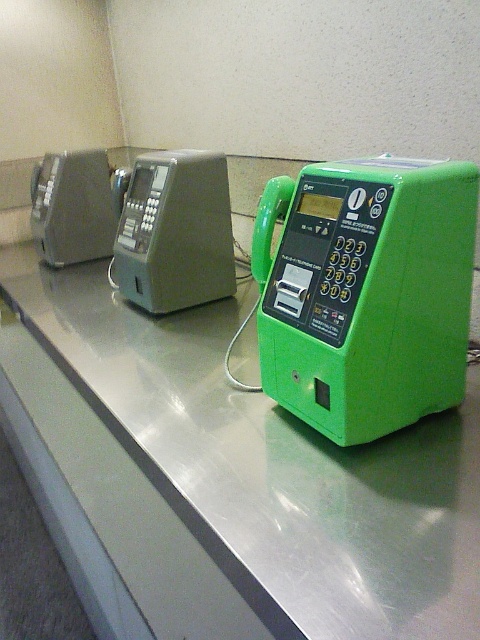
Is point (388, 534) more distant than point (462, 172)?

No, (388, 534) is closer to viewer.

Can you confirm if green plastic phone at right is wider than green plastic payphone at center?

Correct, the width of green plastic phone at right exceeds that of green plastic payphone at center.

Between point (83, 538) and point (301, 252), which one is positioned behind?

Positioned behind is point (83, 538).

Image resolution: width=480 pixels, height=640 pixels. Find the location of `green plastic phone at right`. green plastic phone at right is located at coordinates (228, 481).

Based on the photo, who is higher up, green plastic phone at right or matte gray phone box at center?

matte gray phone box at center is higher up.

Does green plastic phone at right have a lesser width compared to matte gray phone box at center?

Incorrect, green plastic phone at right's width is not less than matte gray phone box at center's.

Between point (96, 573) and point (170, 189), which one is positioned in front?

Point (96, 573) is more forward.

Locate an element on the screen. This screenshot has width=480, height=640. green plastic phone at right is located at coordinates (228, 481).

Is point (367, 288) closer to viewer compared to point (123, 275)?

Yes, it is.

I want to click on green plastic payphone at center, so click(365, 291).

What do you see at coordinates (365, 291) in the screenshot? The width and height of the screenshot is (480, 640). I see `green plastic payphone at center` at bounding box center [365, 291].

Locate an element on the screen. This screenshot has height=640, width=480. green plastic payphone at center is located at coordinates (365, 291).